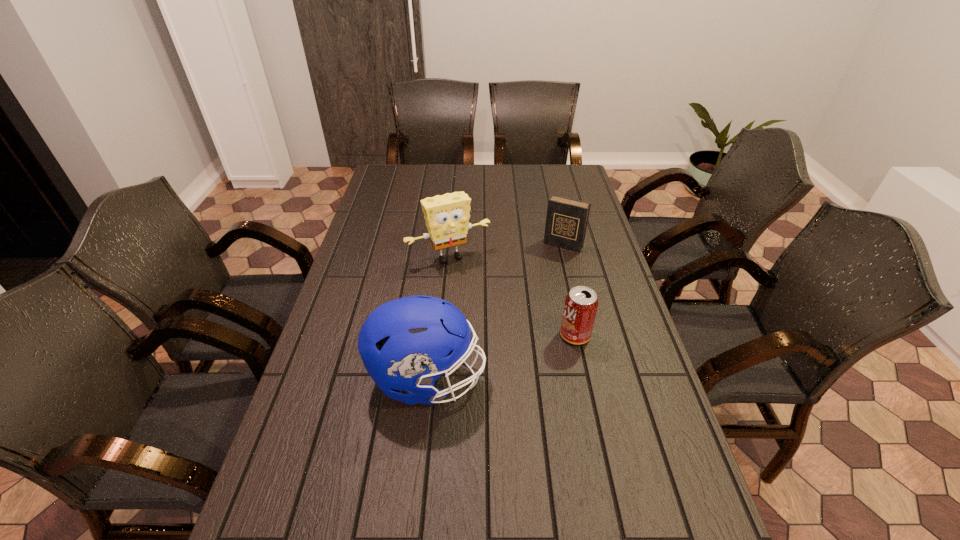
At what (x,y) coordinates should I click in order to perform the action: click on free space on the desktop that is between the football helmet and the soda can and is positioned on the face of the sponge. Please return your answer as a coordinate pair (x, y). This screenshot has height=540, width=960. Looking at the image, I should click on (506, 355).

Image resolution: width=960 pixels, height=540 pixels. What are the coordinates of `free spot on the desktop that is between the football helmet and the shortest object and is positioned on the front cover of the diary` in the screenshot? It's located at (504, 356).